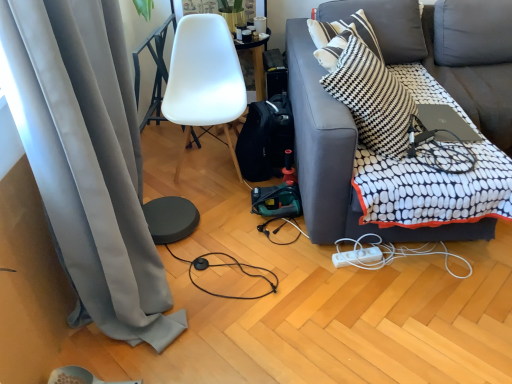
Find the location of a particular element. The image size is (512, 384). vacant area that is in front of white plastic power strip at lower right is located at coordinates 419,327.